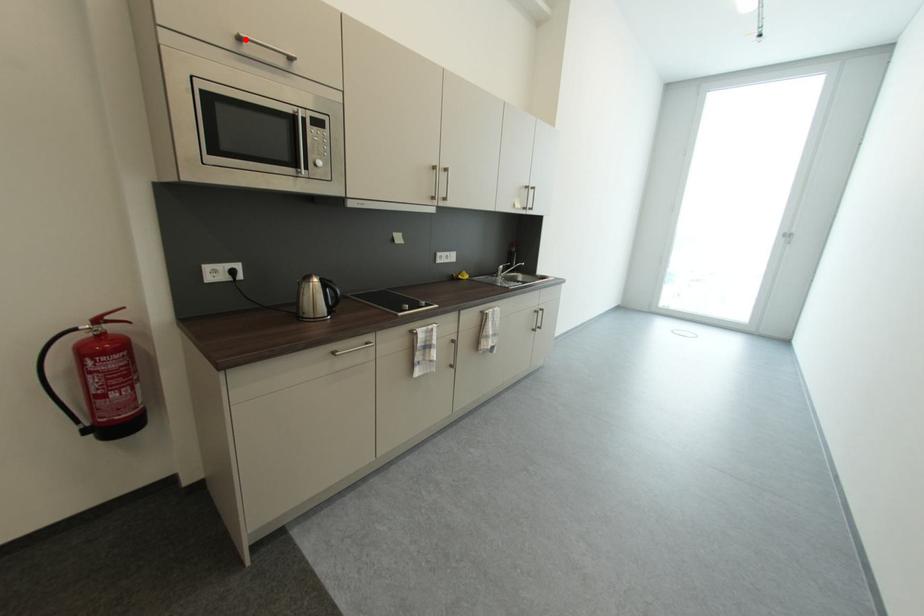
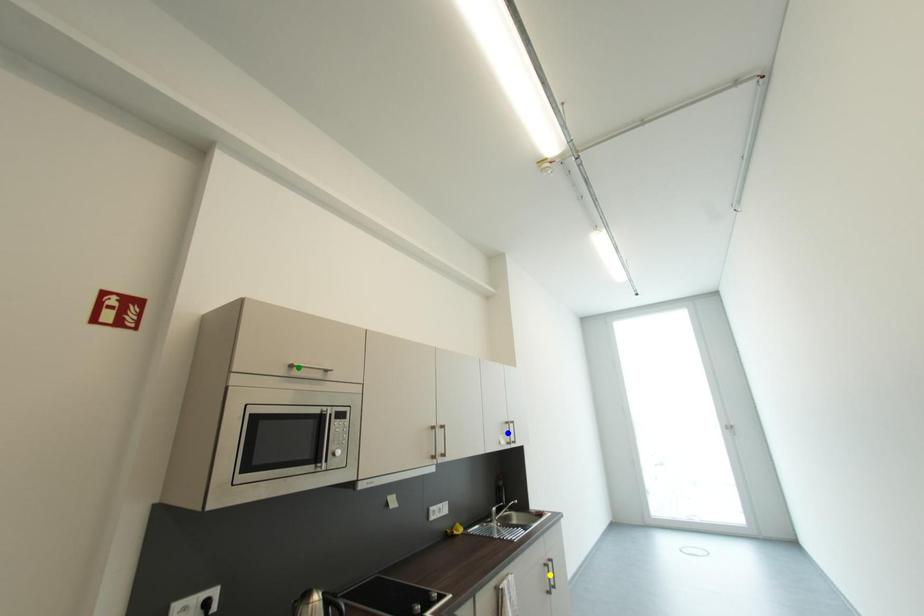
Question: I am providing you with two images of the same scene from different viewpoints. A red point is marked on the first image. You are given multiple points on the second image. Which spot in image 2 lines up with the point in image 1?

Choices:
 (A) green point
 (B) blue point
 (C) yellow point

Answer: (A)